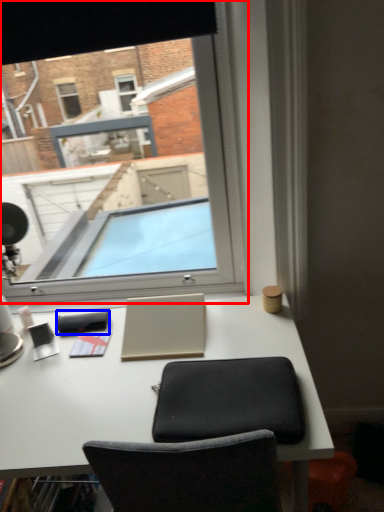
Question: Which object appears farthest to the camera in this image, window (highlighted by a red box) or notepad (highlighted by a blue box)?

Choices:
 (A) window
 (B) notepad

Answer: (B)